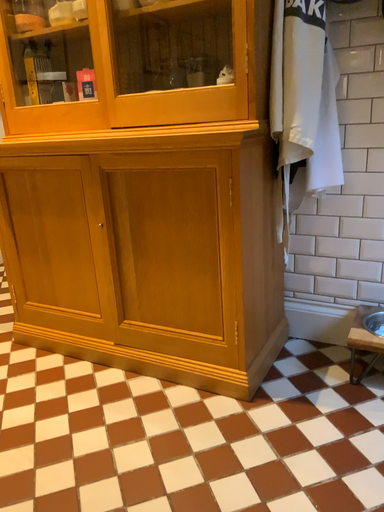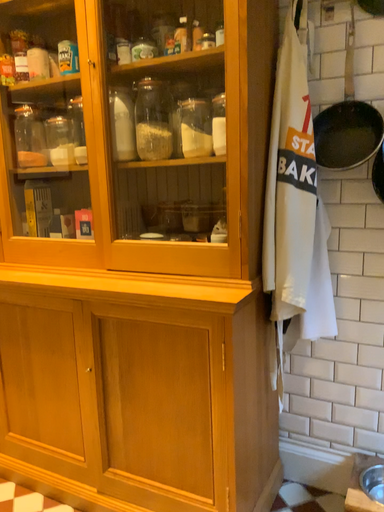
Question: Which way did the camera rotate in the video?

Choices:
 (A) rotated downward
 (B) rotated upward

Answer: (B)